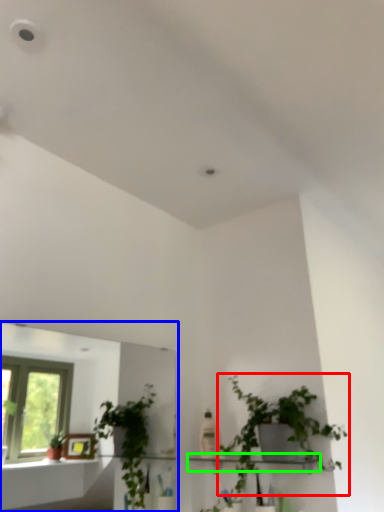
Question: Which object is the closest to the houseplant (highlighted by a red box)? Choose among these: mirror (highlighted by a blue box) or shelf (highlighted by a green box).

Choices:
 (A) mirror
 (B) shelf

Answer: (B)